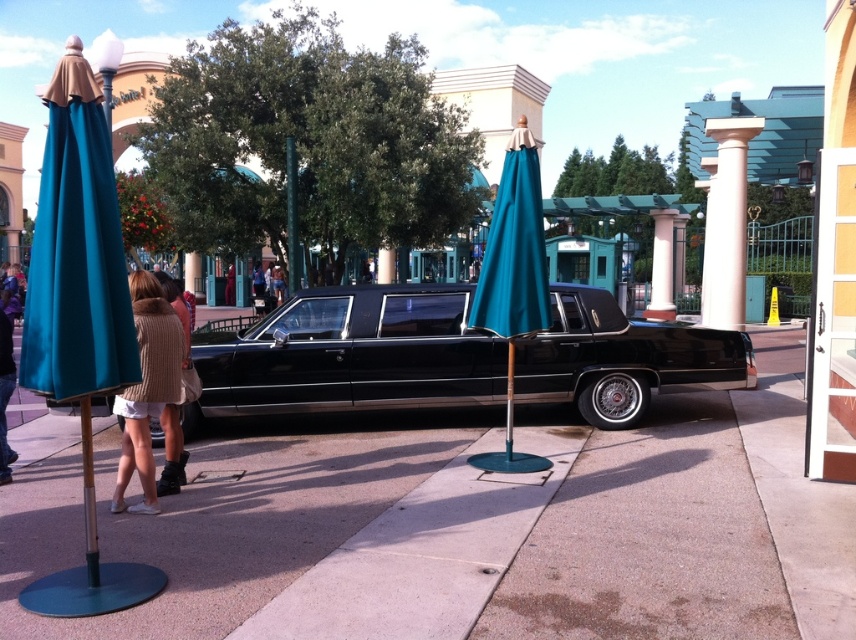
Between pink polished stone column at center and pink painted stone column at center, which one appears on the left side from the viewer's perspective?

pink polished stone column at center is more to the left.

Which is behind, point (720, 154) or point (664, 248)?

Point (664, 248)

What do you see at coordinates (726, 221) in the screenshot? I see `pink polished stone column at center` at bounding box center [726, 221].

Find the location of a particular element. This screenshot has width=856, height=640. pink polished stone column at center is located at coordinates (726, 221).

Who is taller, black glossy limousine at center or teal fabric umbrella at left?

teal fabric umbrella at left

Locate an element on the screen. black glossy limousine at center is located at coordinates (349, 355).

Identify the location of black glossy limousine at center. (349, 355).

Based on the photo, who is taller, teal fabric umbrella at left or pink polished stone column at center?

Standing taller between the two is pink polished stone column at center.

Is teal fabric umbrella at left further to the viewer compared to pink polished stone column at center?

That is False.

Find the location of a particular element. teal fabric umbrella at left is located at coordinates (79, 305).